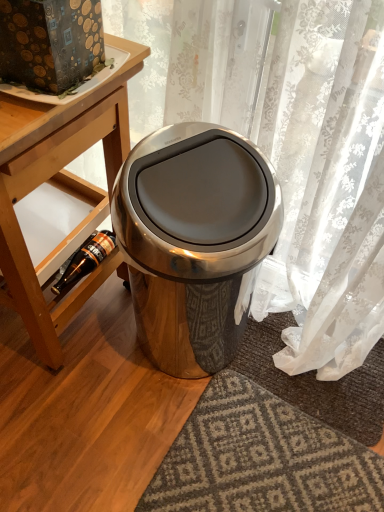
What are the coordinates of `vacant space underneath satin metallic trash can at center (from a real-world perspective)` in the screenshot? It's located at (177, 356).